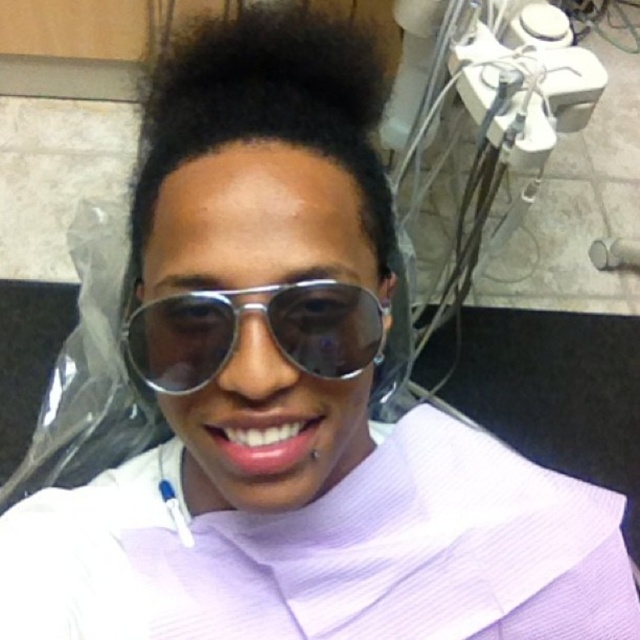
You are a dental assistant standing 10 inches away from the dental chair. You need to hand the patient a consent form. The dark matte hair at upper center is in your line of sight. Can you reach the patient without moving closer than 10 inches?

The dark matte hair at upper center is 14.39 inches away from viewer. Since you are already 10 inches away from the dental chair, you are within reach to hand the consent form without moving closer than 10 inches.

You are a dental hygienist preparing to clean the patient. The dark matte hair at upper center and the metallic reflective goggles at center are in the way. Can you move the goggles to the side without touching the patient?

The dark matte hair at upper center is positioned over metallic reflective goggles at center, so you can carefully move the metallic reflective goggles at center to the side without touching the patient by adjusting them underneath the hair.

The dental chair is positioned in a room with a beige and brown tiled wall. There is a point marked at coordinates (268, 106). What object is located at that point?

The point at coordinates (268, 106) corresponds to the dark matte hair at upper center.